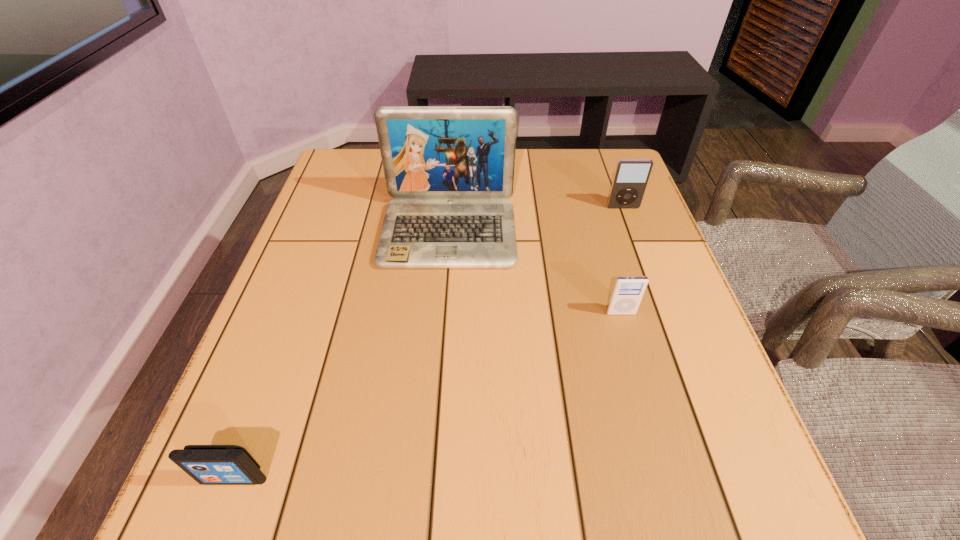
Where is `vacant area located 0.280m on the front-facing side of the second iPod from left to right`? vacant area located 0.280m on the front-facing side of the second iPod from left to right is located at coordinates (661, 457).

Locate an element on the screen. object at the near edge is located at coordinates (207, 464).

The width and height of the screenshot is (960, 540). I want to click on object present at the left edge, so click(207, 464).

Where is `object that is at the near left corner`? The width and height of the screenshot is (960, 540). object that is at the near left corner is located at coordinates (207, 464).

Locate an element on the screen. The image size is (960, 540). vacant space at the far edge of the desktop is located at coordinates (386, 185).

Image resolution: width=960 pixels, height=540 pixels. In the image, there is a desktop. Find the location of `blank space at the left edge`. blank space at the left edge is located at coordinates (299, 350).

This screenshot has height=540, width=960. In the image, there is a desktop. Identify the location of vacant region at the right edge. (605, 242).

This screenshot has width=960, height=540. I want to click on free space at the far left corner of the desktop, so click(381, 190).

Where is `vacant area at the far right corner`? The width and height of the screenshot is (960, 540). vacant area at the far right corner is located at coordinates (612, 172).

This screenshot has height=540, width=960. What are the coordinates of `blank space at the near right corner` in the screenshot? It's located at (758, 528).